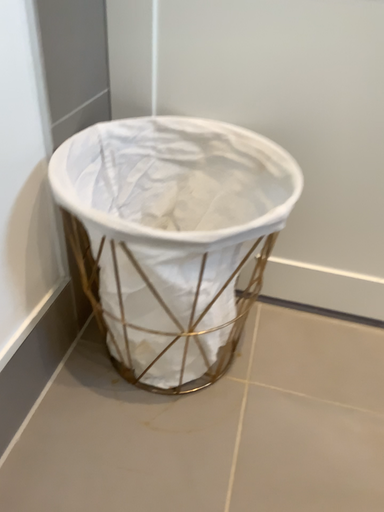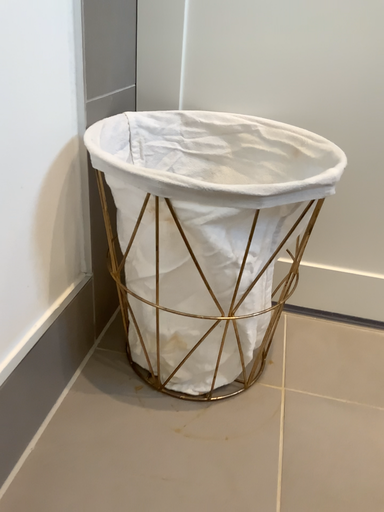
Question: How did the camera likely rotate when shooting the video?

Choices:
 (A) rotated downward
 (B) rotated upward

Answer: (B)